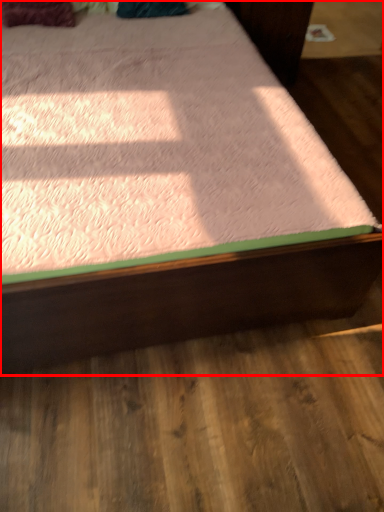
Question: Observing the image, what is the correct spatial positioning of bed (annotated by the red box) in reference to pillow?

Choices:
 (A) right
 (B) left

Answer: (A)